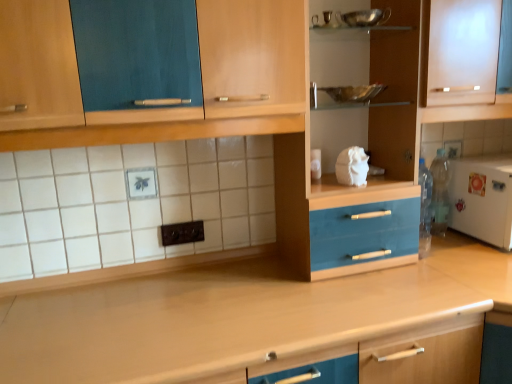
Question: From a real-world perspective, is wooden at center physically located above or below white matte refrigerator at right?

Choices:
 (A) above
 (B) below

Answer: (B)

Question: Is wooden at center spatially inside white matte refrigerator at right, or outside of it?

Choices:
 (A) inside
 (B) outside

Answer: (B)

Question: Which of these objects is positioned farthest from the metallic silver bowl at upper center?

Choices:
 (A) frosted glass cabinet at upper right
 (B) wooden at center
 (C) white matte refrigerator at right

Answer: (B)

Question: Which object is positioned farthest from the frosted glass cabinet at upper right?

Choices:
 (A) wooden at center
 (B) white matte refrigerator at right
 (C) metallic silver bowl at upper center

Answer: (A)